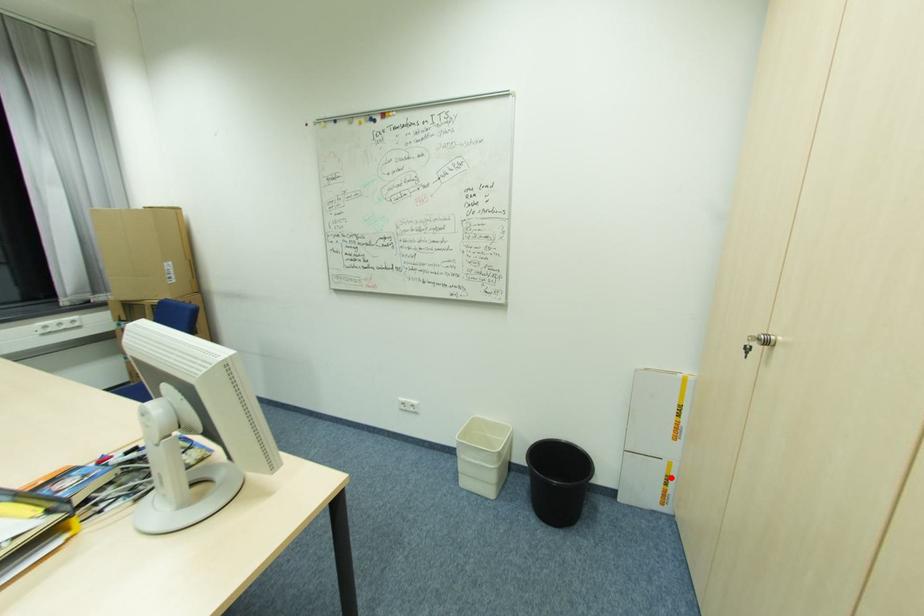
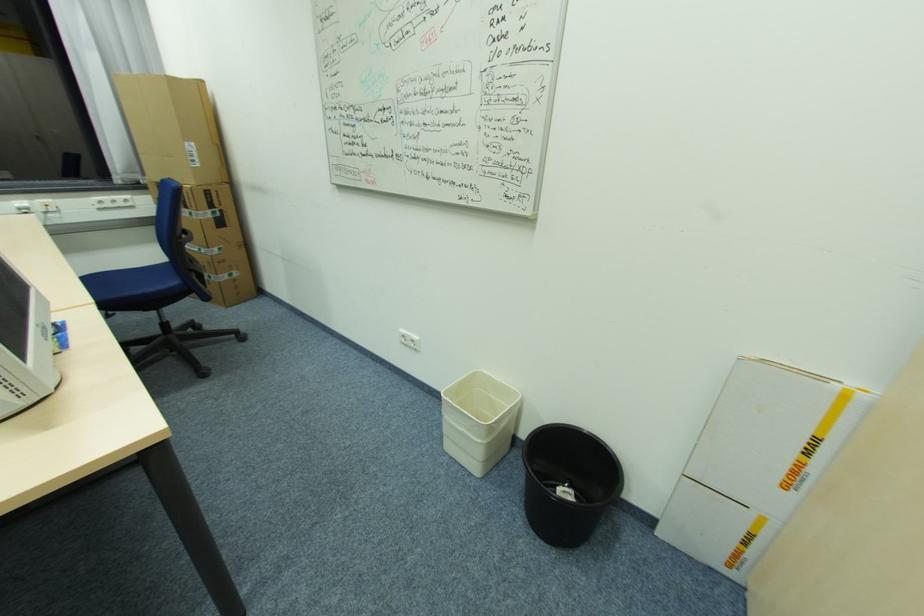
Locate, in the second image, the point that corresponds to the highlighted location in the first image.

(752, 535)